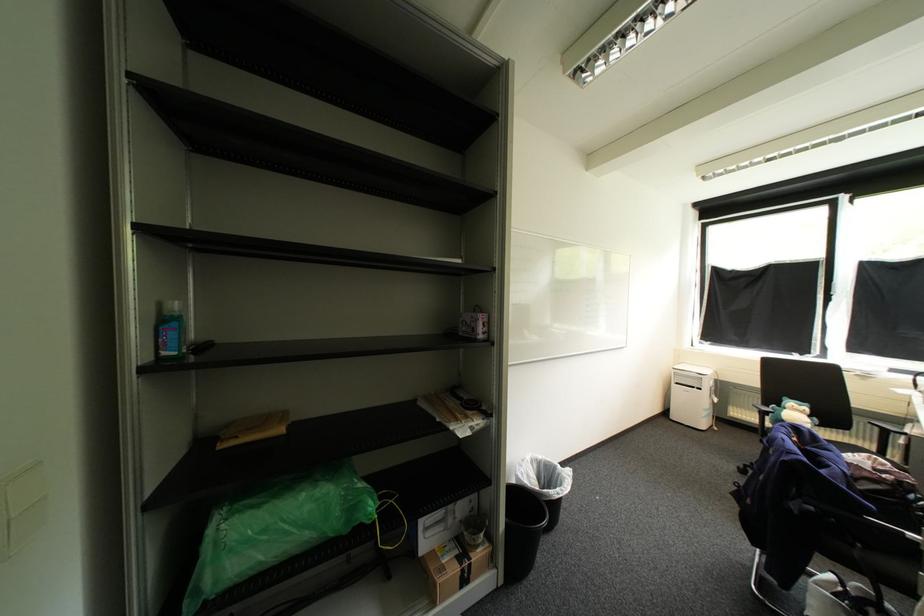
Where is `chair armrest`? The height and width of the screenshot is (616, 924). chair armrest is located at coordinates (892, 528).